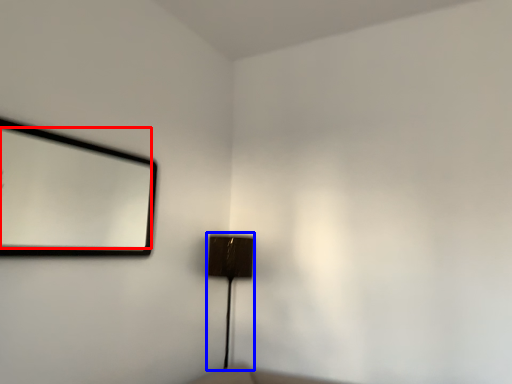
Question: Which object is further to the camera taking this photo, mirror (highlighted by a red box) or lamp (highlighted by a blue box)?

Choices:
 (A) mirror
 (B) lamp

Answer: (B)